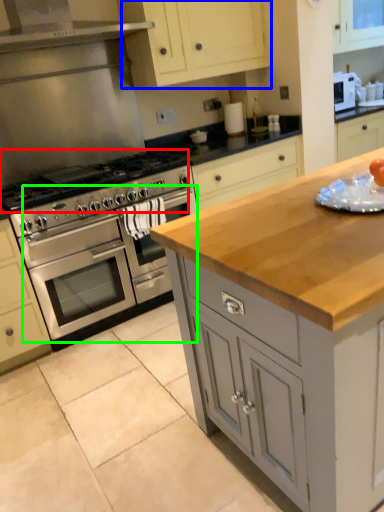
Question: Which object is the farthest from gas stove (highlighted by a red box)? Choose among these: cabinetry (highlighted by a blue box) or oven (highlighted by a green box).

Choices:
 (A) cabinetry
 (B) oven

Answer: (A)